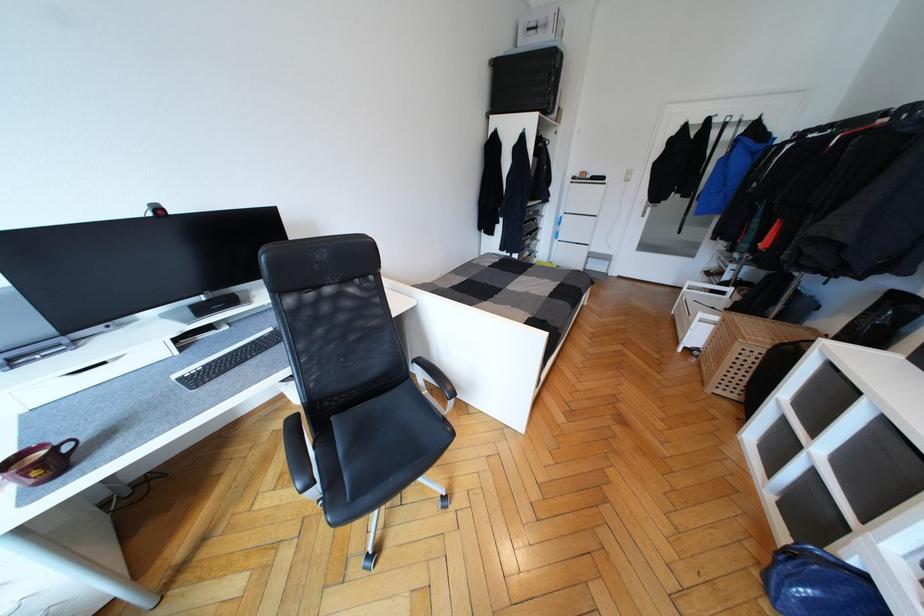
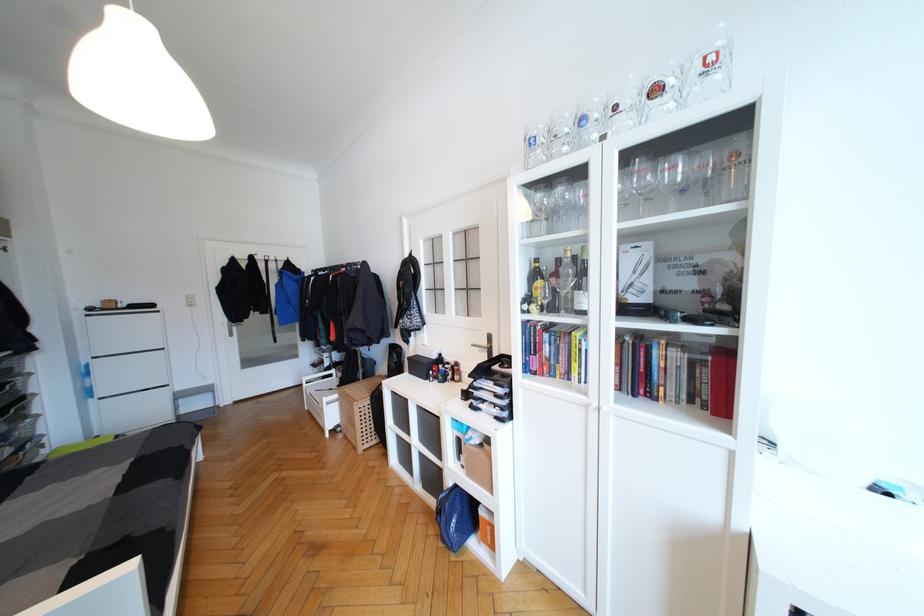
Find the pixel in the second image that matches pixel 587 253 in the first image.

(166, 397)